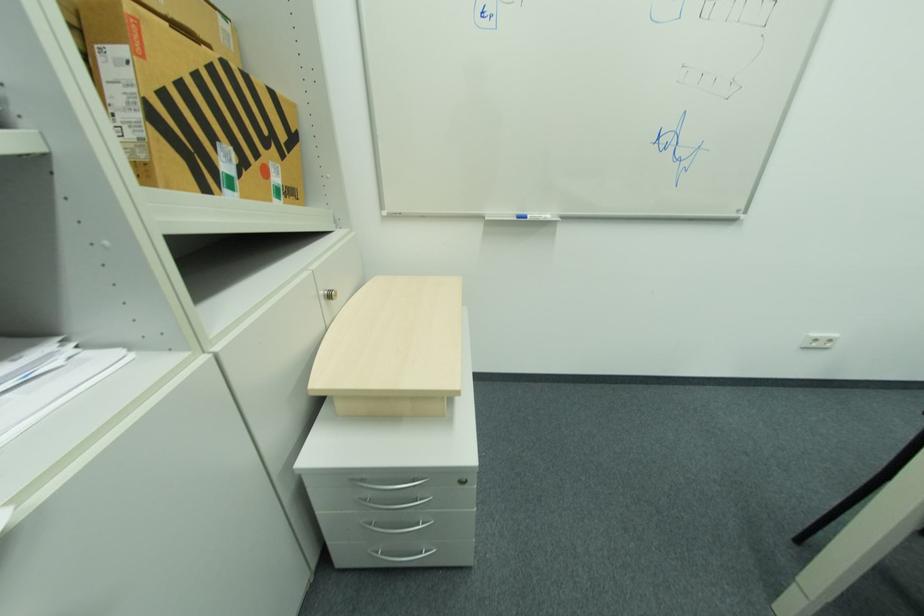
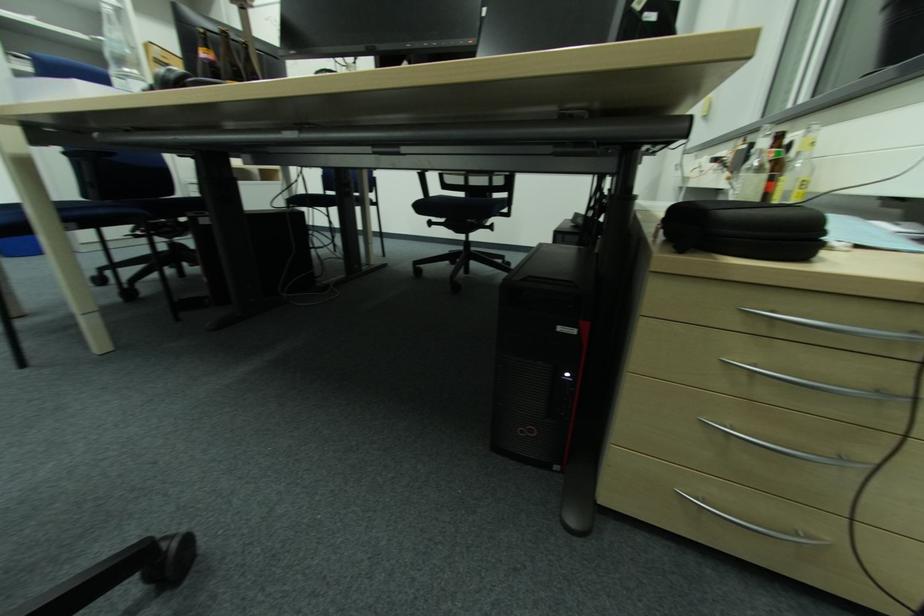
In a continuous first-person perspective shot, in which direction is the camera moving?

The cameraman moved toward right, backward.